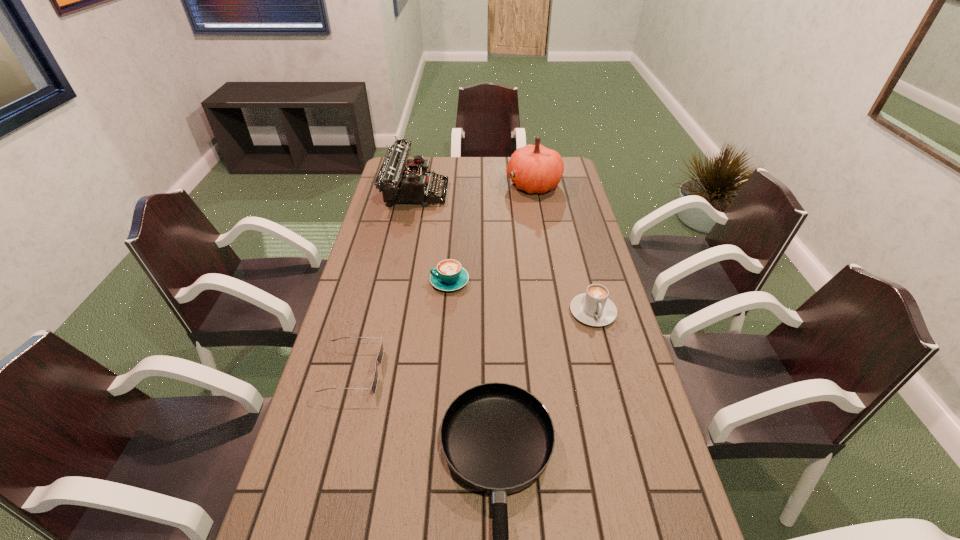
Locate an element on the screen. The image size is (960, 540). pumpkin at the right edge is located at coordinates (537, 169).

The image size is (960, 540). In order to click on cappuccino that is at the right edge in this screenshot , I will do `click(593, 308)`.

Image resolution: width=960 pixels, height=540 pixels. I want to click on object that is at the far left corner, so click(x=399, y=183).

Locate an element on the screen. object that is at the far right corner is located at coordinates (537, 169).

You are a GUI agent. You are given a task and a screenshot of the screen. Output one action in this format:
    pyautogui.click(x=<x>, y=<y>)
    Task: Click on the vacant position at the left edge of the desktop
    This screenshot has width=960, height=540.
    Given the screenshot: What is the action you would take?
    pyautogui.click(x=338, y=372)

Where is `vacant space at the right edge of the desktop`? vacant space at the right edge of the desktop is located at coordinates (584, 373).

Locate an element on the screen. free spot at the far right corner of the desktop is located at coordinates tap(573, 179).

Identify the location of empty space that is in between the pumpkin and the left cappuccino. pyautogui.click(x=492, y=233).

You are a GUI agent. You are given a task and a screenshot of the screen. Output one action in this format:
    pyautogui.click(x=<x>, y=<y>)
    Task: Click on the vacant space that is in between the taller cappuccino and the shortest object
    The height and width of the screenshot is (540, 960).
    Given the screenshot: What is the action you would take?
    pyautogui.click(x=472, y=341)

The width and height of the screenshot is (960, 540). I want to click on vacant point located between the shortest object and the second tallest object, so click(x=384, y=282).